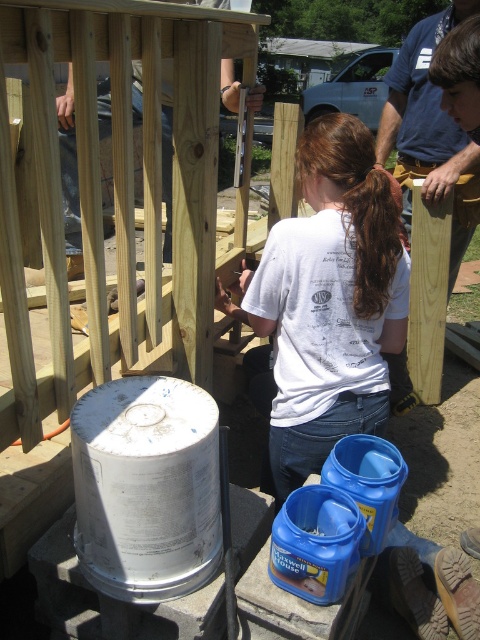
Question: Among these points, which one is nearest to the camera?

Choices:
 (A) (387, 144)
 (B) (356, 305)

Answer: (B)

Question: Is white cotton shirt at center positioned before blue shirt at upper center?

Choices:
 (A) yes
 (B) no

Answer: (A)

Question: Can you confirm if white cotton shirt at center is positioned to the right of blue shirt at upper center?

Choices:
 (A) yes
 (B) no

Answer: (B)

Question: Can you confirm if white cotton shirt at center is positioned below blue shirt at upper center?

Choices:
 (A) yes
 (B) no

Answer: (A)